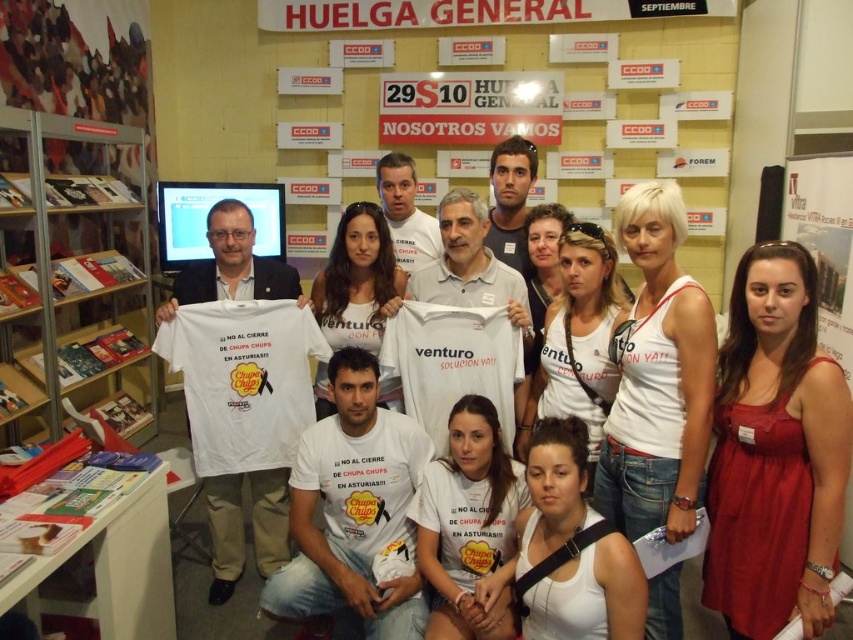
Between red satin dress at lower right and metallic silver bookshelf at left, which one has more height?

Standing taller between the two is metallic silver bookshelf at left.

How much distance is there between red satin dress at lower right and metallic silver bookshelf at left?

red satin dress at lower right is 3.12 meters from metallic silver bookshelf at left.

This screenshot has height=640, width=853. What do you see at coordinates (775, 452) in the screenshot?
I see `red satin dress at lower right` at bounding box center [775, 452].

I want to click on red satin dress at lower right, so click(775, 452).

This screenshot has width=853, height=640. Identify the location of red satin dress at lower right. (775, 452).

What do you see at coordinates (775, 452) in the screenshot? I see `red satin dress at lower right` at bounding box center [775, 452].

Is point (714, 484) closer to camera compared to point (606, 483)?

Yes, point (714, 484) is in front of point (606, 483).

Image resolution: width=853 pixels, height=640 pixels. Identify the location of red satin dress at lower right. (775, 452).

Between white cotton t-shirt at center and metallic silver bookshelf at left, which one appears on the right side from the viewer's perspective?

From the viewer's perspective, white cotton t-shirt at center appears more on the right side.

Consider the image. Which is above, white cotton t-shirt at center or metallic silver bookshelf at left?

metallic silver bookshelf at left

Does point (277, 502) come farther from viewer compared to point (36, 170)?

No, (277, 502) is in front of (36, 170).

What are the coordinates of `white cotton t-shirt at center` in the screenshot? It's located at (231, 266).